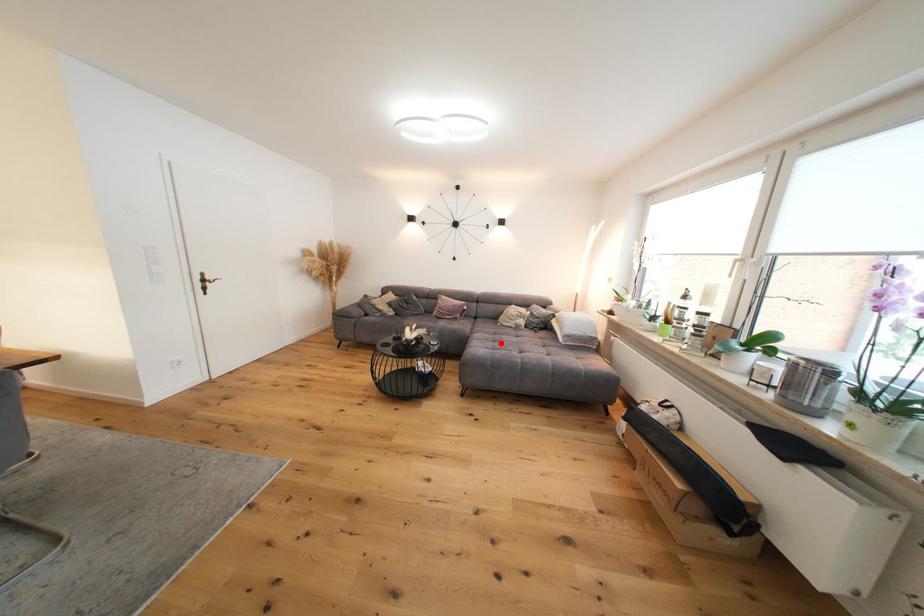
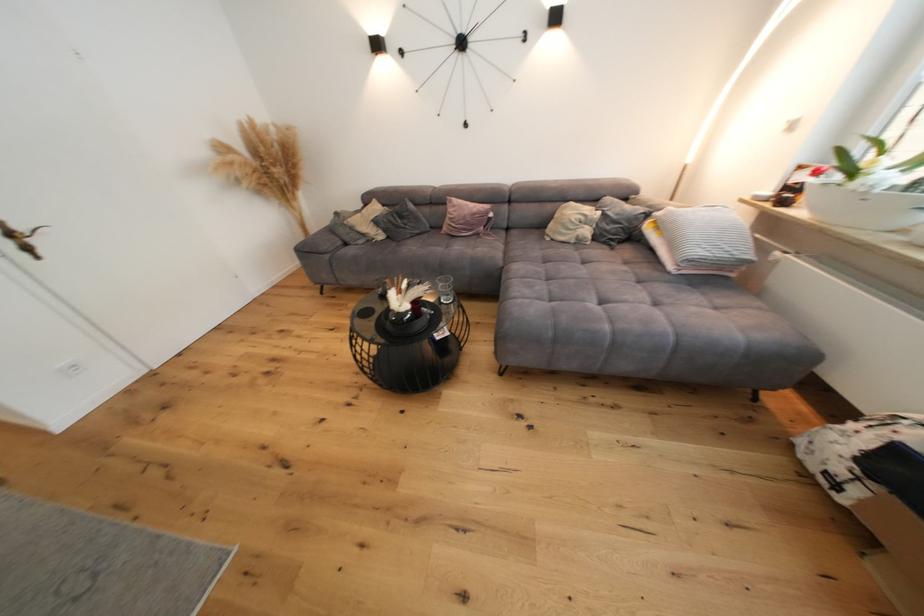
Locate, in the second image, the point that corresponds to the highlighted location in the first image.

(553, 282)